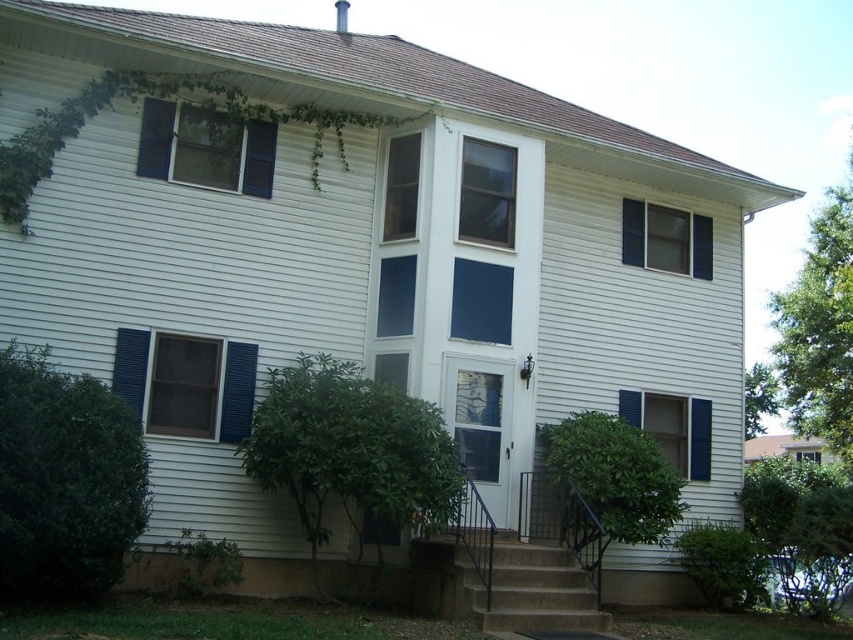
Question: Considering the real-world distances, which object is closest to the brown concrete stairs at center?

Choices:
 (A) blue painted wood shutter at left
 (B) blue painted wood window at lower right
 (C) matte blue shutters at left

Answer: (B)

Question: Does blue matte window at upper center come behind clear glass window at upper center?

Choices:
 (A) yes
 (B) no

Answer: (B)

Question: Based on their relative distances, which object is farther from the blue painted wood shutter at left?

Choices:
 (A) brown concrete stairs at center
 (B) blue matte window at upper center
 (C) blue painted wood window at lower right

Answer: (C)

Question: Which is nearer to the clear glass window at center?

Choices:
 (A) blue painted wood window at lower right
 (B) blue matte window at upper center
 (C) blue painted wood shutter at left
 (D) blue painted wood window at upper right

Answer: (D)

Question: Observing the image, what is the correct spatial positioning of matte blue shutters at left in reference to blue painted wood window at lower right?

Choices:
 (A) above
 (B) below

Answer: (A)

Question: Does matte blue shutters at left have a lesser width compared to clear glass window at center?

Choices:
 (A) yes
 (B) no

Answer: (B)